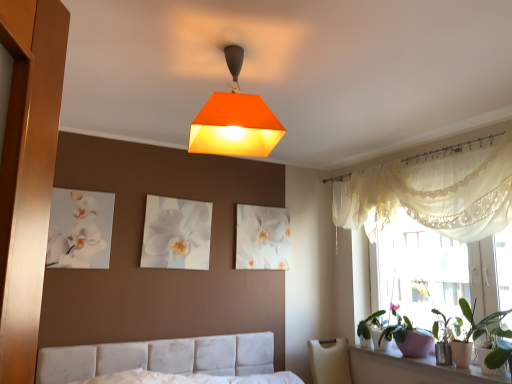
Question: Is green matte plant at right in front of or behind orange matte lampshade at upper center in the image?

Choices:
 (A) behind
 (B) front

Answer: (A)

Question: Do you think green matte plant at right is within orange matte lampshade at upper center, or outside of it?

Choices:
 (A) outside
 (B) inside

Answer: (A)

Question: Considering the real-world distances, which object is closest to the white fabric bed at lower center?

Choices:
 (A) white glossy canvas at center, which is counted as the 2th picture frame, starting from the right
 (B) white lace curtain at upper right
 (C) white ceramic window sill at lower right
 (D) translucent fabric at upper right
 (E) white glossy canvas at upper left, the 3th picture frame viewed from the right

Answer: (A)

Question: Considering the real-world distances, which object is closest to the orange matte lampshade at upper center?

Choices:
 (A) white lace curtain at upper right
 (B) white glossy picture frame at center, the 1th picture frame in the right-to-left sequence
 (C) white fabric bed at lower center
 (D) white ceramic window sill at lower right
 (E) white glossy canvas at upper left, the 3th picture frame viewed from the right

Answer: (E)